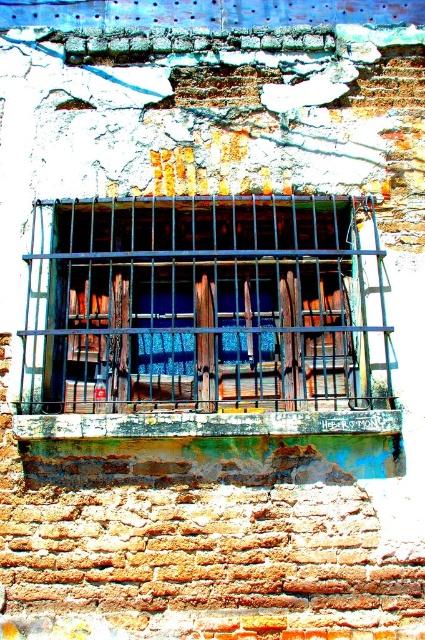
Question: Observing the image, what is the correct spatial positioning of metallic bars at center in reference to rusty metal window sill at center?

Choices:
 (A) below
 (B) above

Answer: (B)

Question: Among these points, which one is farthest from the camera?

Choices:
 (A) (62, 300)
 (B) (297, 426)

Answer: (A)

Question: Can you confirm if metallic bars at center is bigger than rusty metal window sill at center?

Choices:
 (A) yes
 (B) no

Answer: (A)

Question: Is metallic bars at center thinner than rusty metal window sill at center?

Choices:
 (A) yes
 (B) no

Answer: (B)

Question: Which point is farther from the camera taking this photo?

Choices:
 (A) (212, 308)
 (B) (99, 426)

Answer: (A)